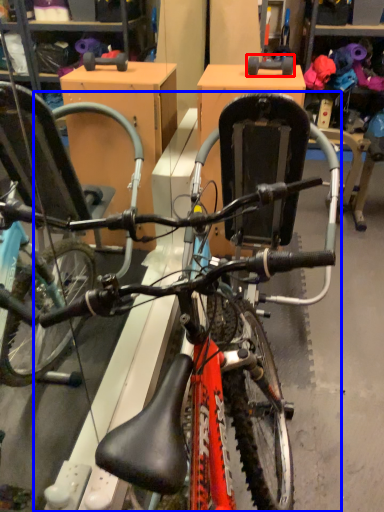
Question: Which object is closer to the camera taking this photo, wheel (highlighted by a red box) or bicycle (highlighted by a blue box)?

Choices:
 (A) wheel
 (B) bicycle

Answer: (B)